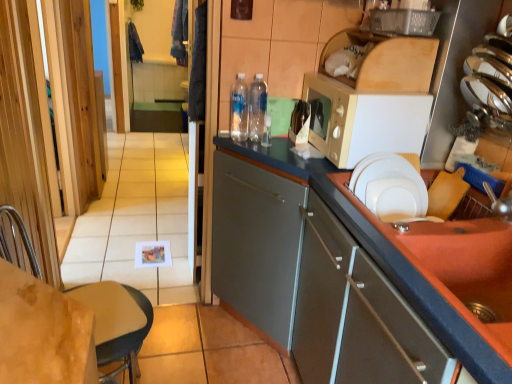
I want to click on vacant area located to the right-hand side of clear plastic bottles at center, positioned as the second bottle in left-to-right order, so [x=276, y=144].